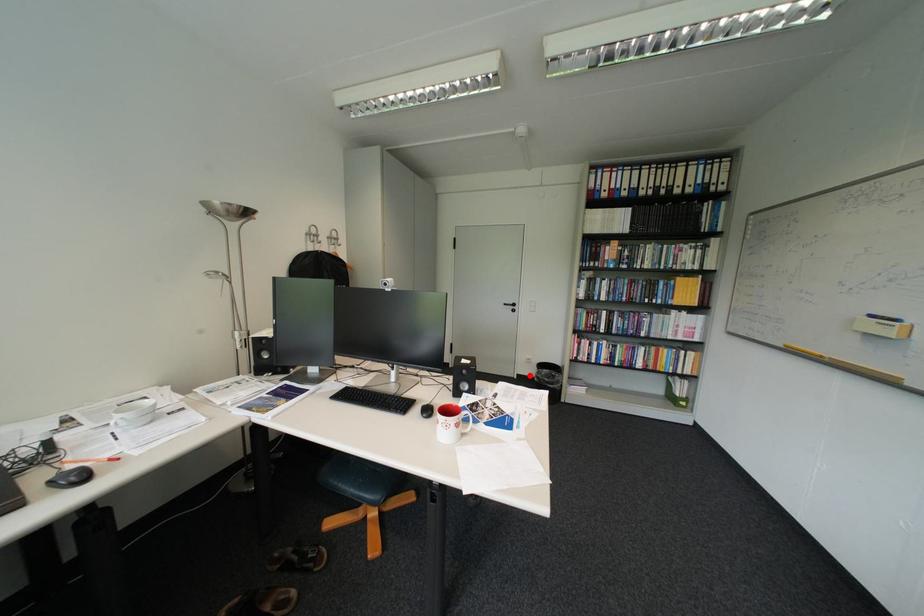
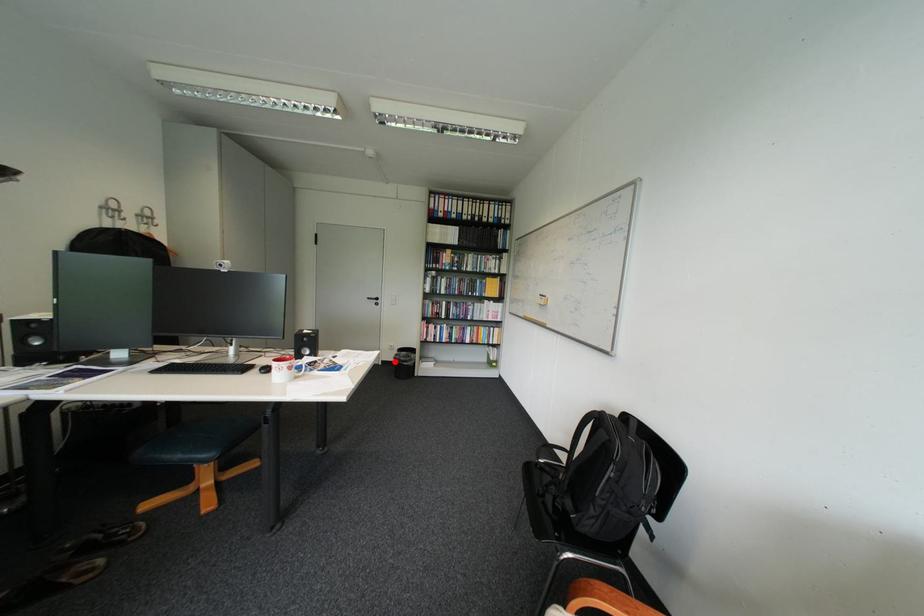
I am providing you with two images of the same scene from different viewpoints. A red point is marked on the first image and another point is marked on the second image. Is the marked point in image1 the same physical position as the marked point in image2?

Yes